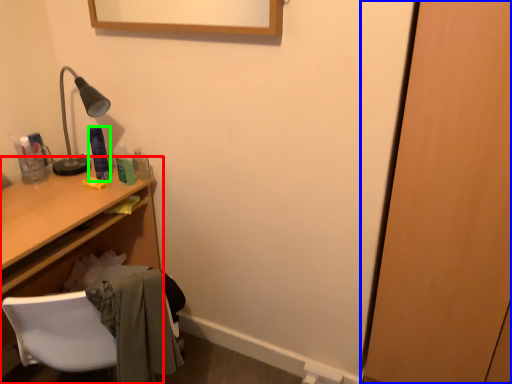
Question: Estimate the real-world distances between objects in this image. Which object is farther from desk (highlighted by a red box), door (highlighted by a blue box) or toiletry (highlighted by a green box)?

Choices:
 (A) door
 (B) toiletry

Answer: (A)